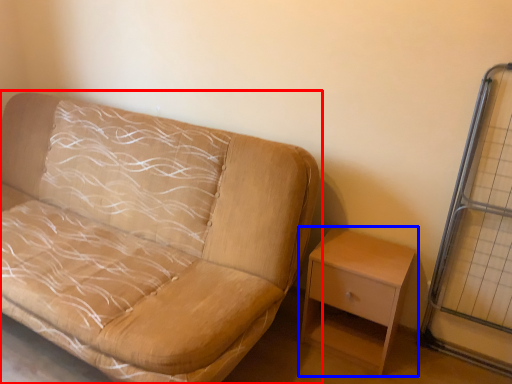
Question: Which object appears closest to the camera in this image, studio couch (highlighted by a red box) or nightstand (highlighted by a blue box)?

Choices:
 (A) studio couch
 (B) nightstand

Answer: (A)